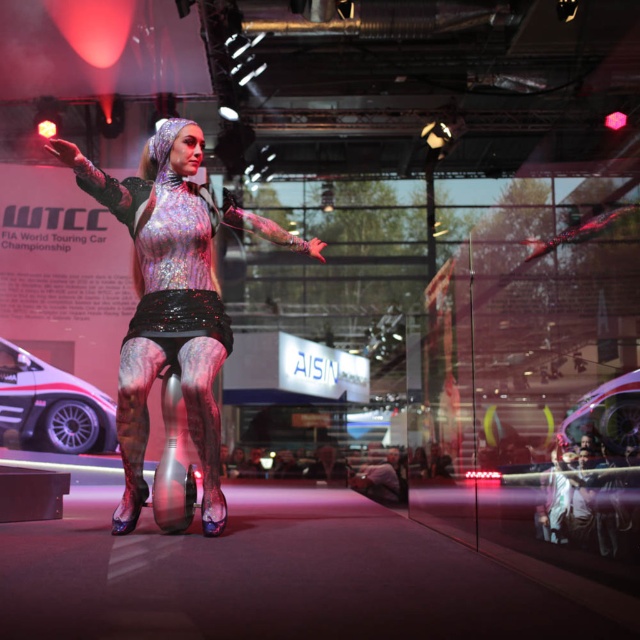
Looking at this image, you are a photographer in the WTCC event. You need to capture a photo where the shiny metallic bodysuit at center and the white glossy car at left are both visible. Based on their positions, which object is positioned higher in the frame?

The shiny metallic bodysuit at center is located above the white glossy car at left, so it is positioned higher in the frame.

You are an event organizer at the FIA World Touring Car Championship and need to place a promotional banner near the shiny metallic bodysuit at center. According to the coordinates provided, where exactly should the banner be placed relative to the bodysuit?

The shiny metallic bodysuit at center is located at point [172,300]. The promotional banner should be placed near these coordinates to ensure visibility and relevance to the event focal point.